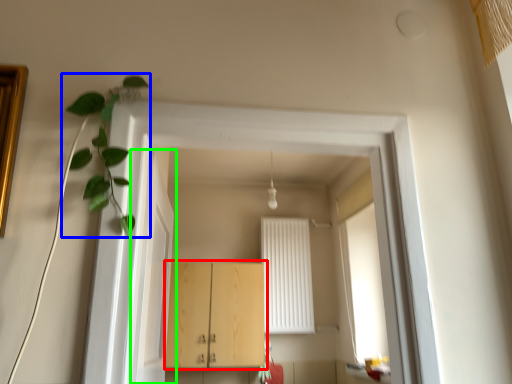
Question: Which object is positioned farthest from cabinetry (highlighted by a red box)? Select from plant (highlighted by a blue box) and door (highlighted by a green box).

Choices:
 (A) plant
 (B) door

Answer: (A)